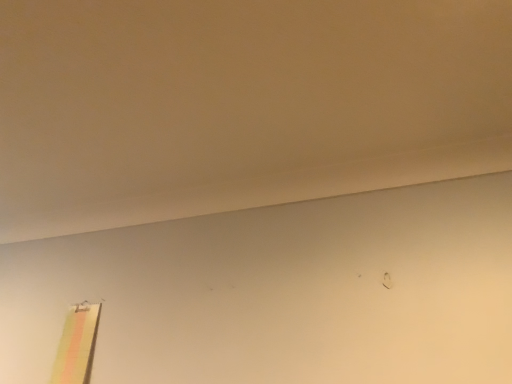
In order to face pastel striped curtain at lower left, should I rotate leftwards or rightwards?

You should look left and rotate roughly 23.139 degrees.

What do you see at coordinates (77, 346) in the screenshot?
I see `pastel striped curtain at lower left` at bounding box center [77, 346].

Locate an element on the screen. The width and height of the screenshot is (512, 384). pastel striped curtain at lower left is located at coordinates [77, 346].

At what (x,y) coordinates should I click in order to perform the action: click on pastel striped curtain at lower left. Please return your answer as a coordinate pair (x, y). Image resolution: width=512 pixels, height=384 pixels. Looking at the image, I should click on (77, 346).